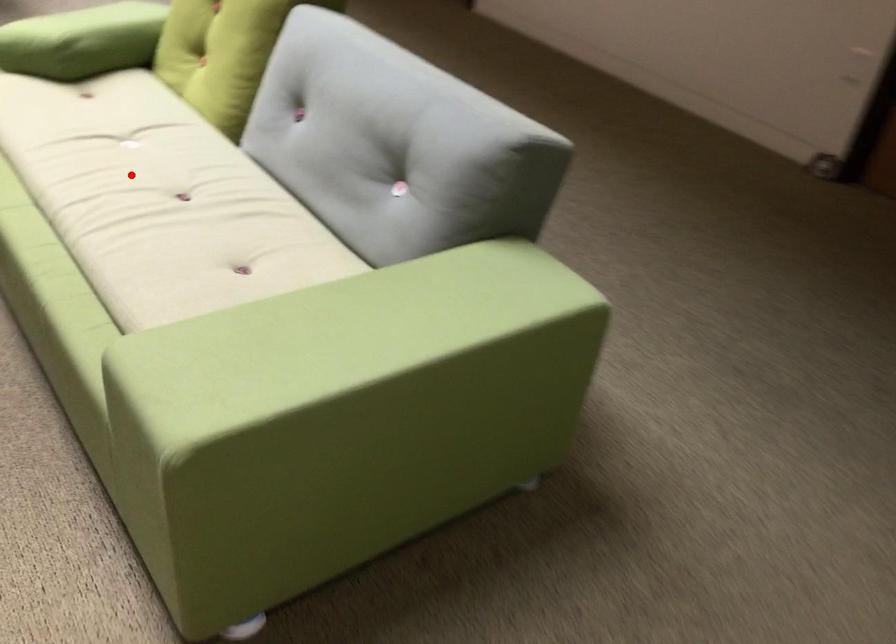
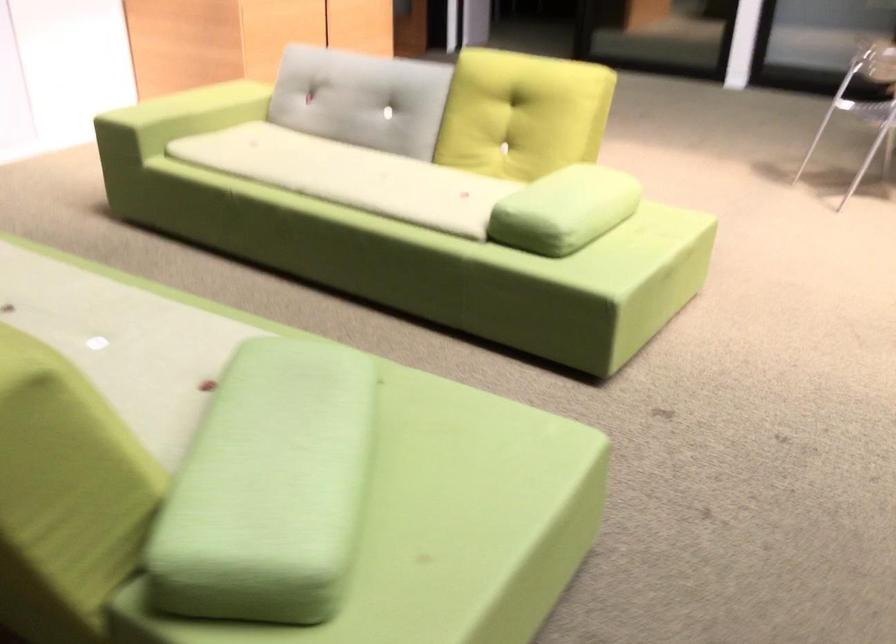
Find the pixel in the second image that matches the highlighted location in the first image.

(66, 290)